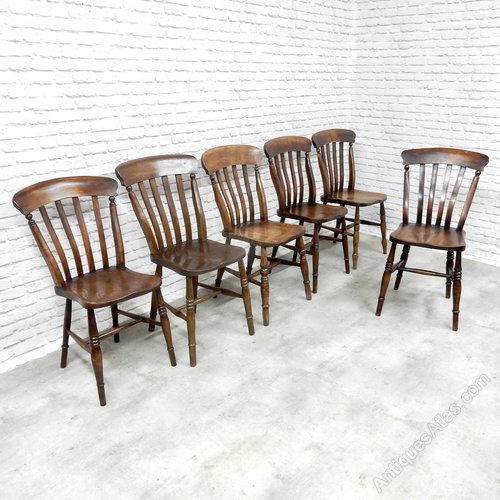
Identify the location of wooden chairs. The width and height of the screenshot is (500, 500). (120, 288), (198, 259), (273, 237), (312, 207), (356, 195), (442, 245).